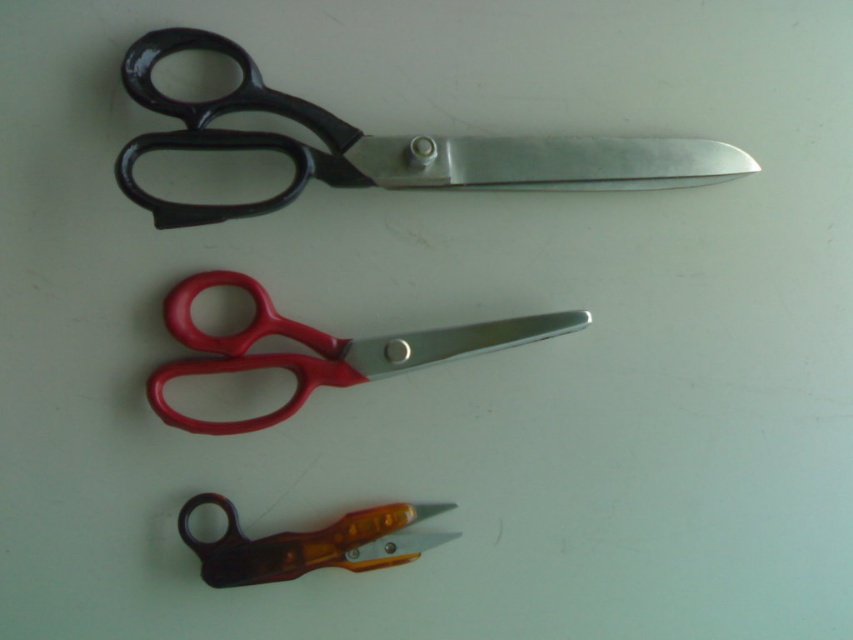
Question: Is red plastic scissors at center above translucent orange plastic scissors at lower center?

Choices:
 (A) no
 (B) yes

Answer: (B)

Question: Can you confirm if red plastic scissors at center is positioned to the right of translucent orange plastic scissors at lower center?

Choices:
 (A) yes
 (B) no

Answer: (A)

Question: Where is red plastic scissors at center located in relation to translucent orange plastic scissors at lower center in the image?

Choices:
 (A) above
 (B) below

Answer: (A)

Question: Which of the following is the closest to the observer?

Choices:
 (A) translucent orange plastic scissors at lower center
 (B) black metallic scissors at upper center

Answer: (B)

Question: Which point is closer to the camera taking this photo?

Choices:
 (A) (479, 332)
 (B) (230, 513)
 (C) (154, 44)

Answer: (C)

Question: Which of the following is the closest to the observer?

Choices:
 (A) (505, 326)
 (B) (228, 516)

Answer: (B)